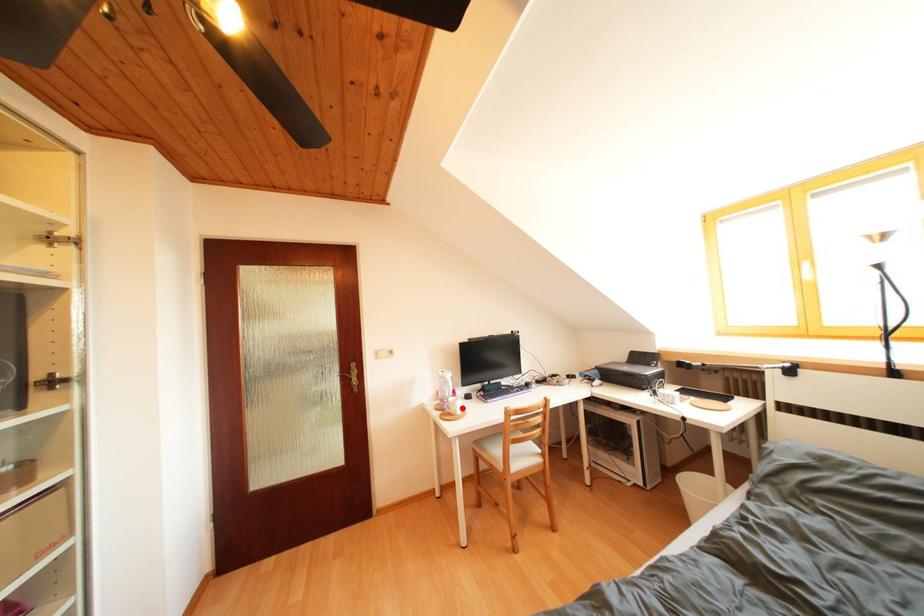
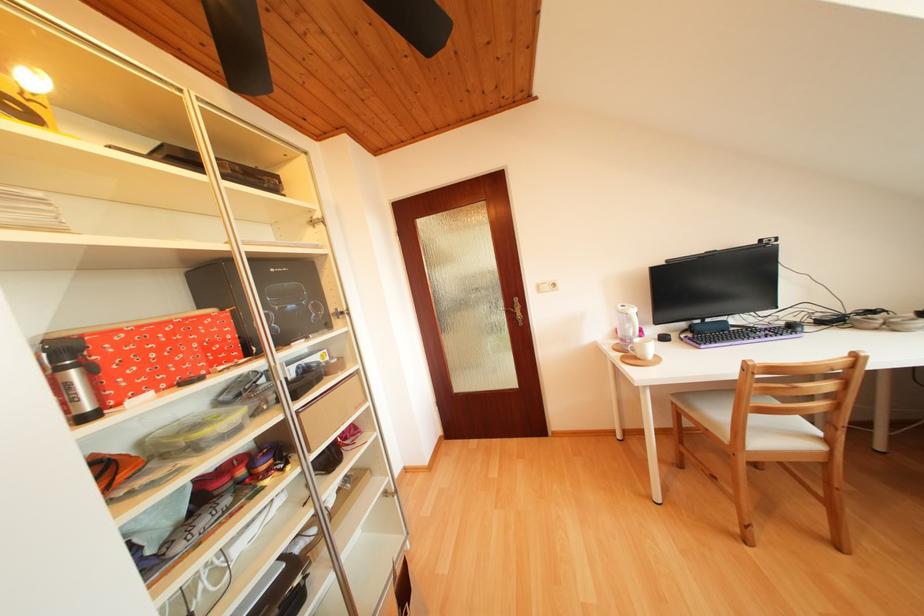
Locate, in the second image, the point that corresponds to the highlighted location in the first image.

(650, 350)